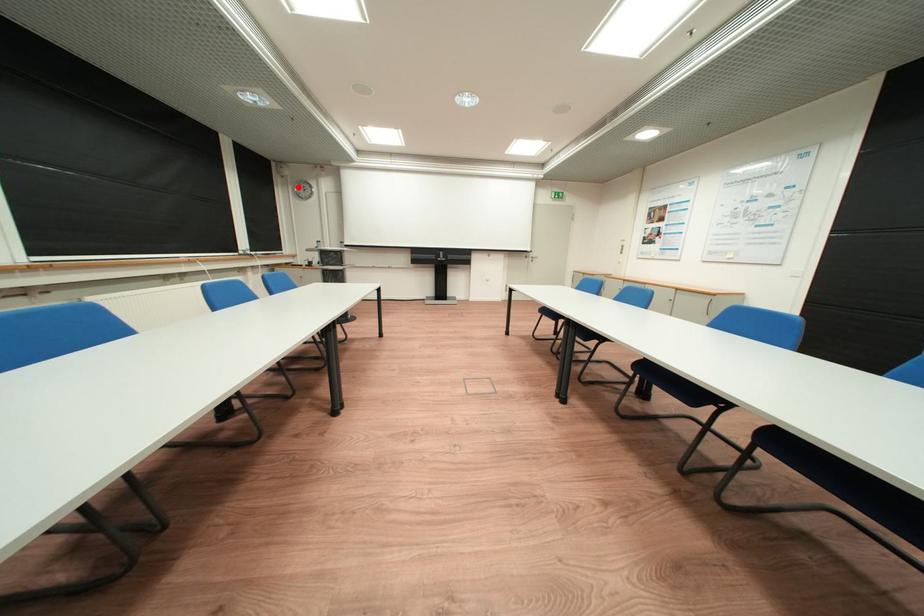
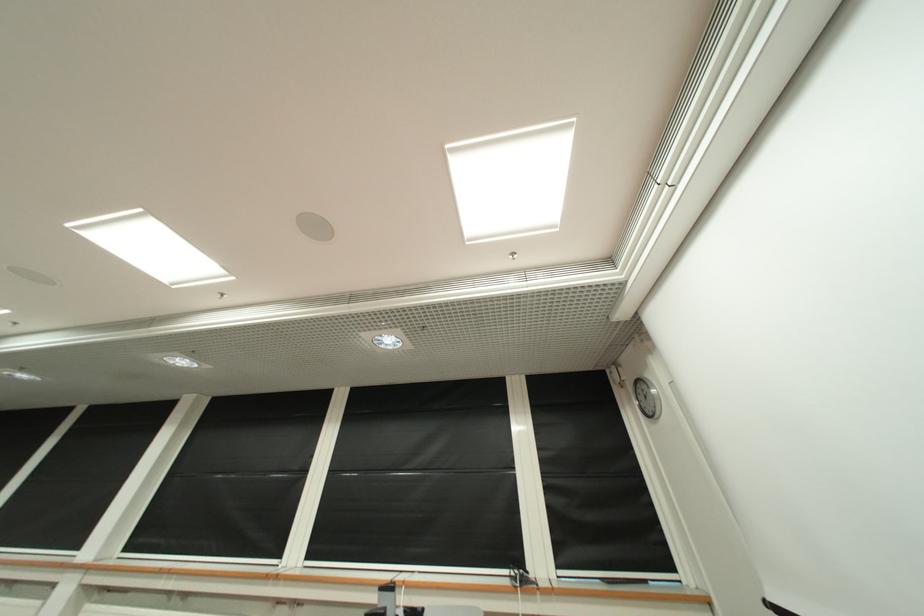
Question: I am providing you with two images of the same scene from different viewpoints. Given a red point in image1, look at the same physical point in image2. Is it:

Choices:
 (A) Closer to the viewpoint
 (B) Farther from the viewpoint

Answer: (B)